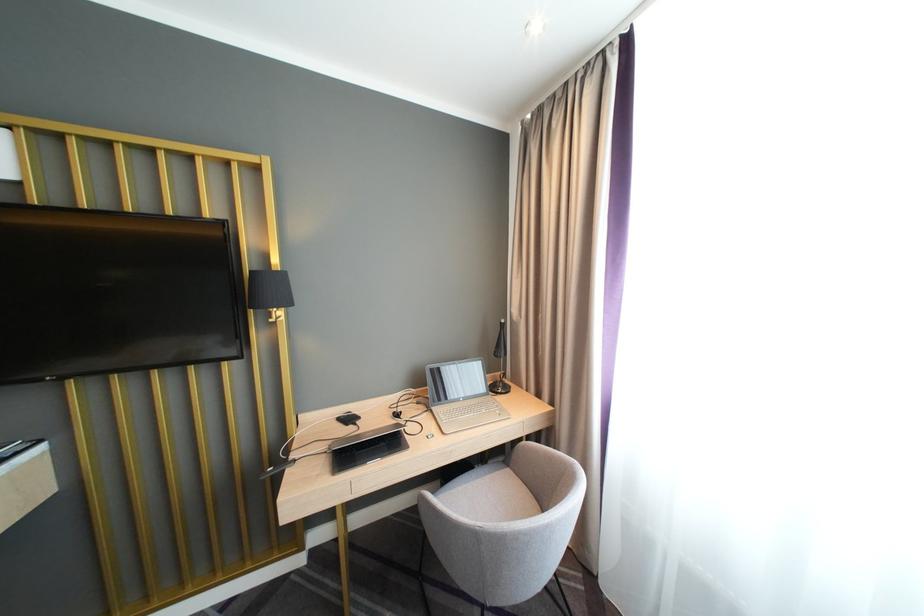
Find the location of a particular element. This screenshot has height=616, width=924. the right chair armrest is located at coordinates (542, 448).